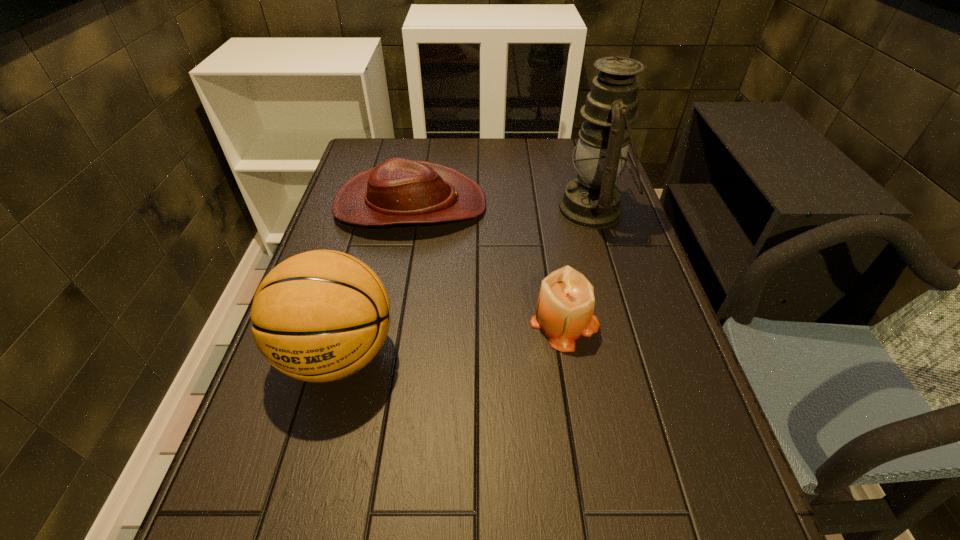
Identify the location of oil lamp. (592, 201).

You are a GUI agent. You are given a task and a screenshot of the screen. Output one action in this format:
    pyautogui.click(x=<x>, y=<y>)
    Task: Click on the second tallest object
    The image size is (960, 540).
    Given the screenshot: What is the action you would take?
    pyautogui.click(x=319, y=316)

Where is `candle`? This screenshot has height=540, width=960. candle is located at coordinates (565, 306).

Find the location of a particular element. The height and width of the screenshot is (540, 960). cowboy hat is located at coordinates (397, 191).

Find the location of a particular element. Image resolution: width=960 pixels, height=540 pixels. free location located on the left of the tallest object is located at coordinates (516, 210).

Locate an element on the screen. The image size is (960, 540). free spot located on the surface of the third shortest object near the brand logo is located at coordinates (287, 539).

Where is `free point located 0.120m on the front of the candle`? free point located 0.120m on the front of the candle is located at coordinates (579, 406).

I want to click on vacant space located on the front-facing side of the cowboy hat, so click(623, 205).

Find the location of a particular element. object that is at the far edge is located at coordinates (397, 191).

At what (x,y) coordinates should I click in order to perform the action: click on basketball that is positioned at the left edge. Please return your answer as a coordinate pair (x, y). Looking at the image, I should click on (319, 316).